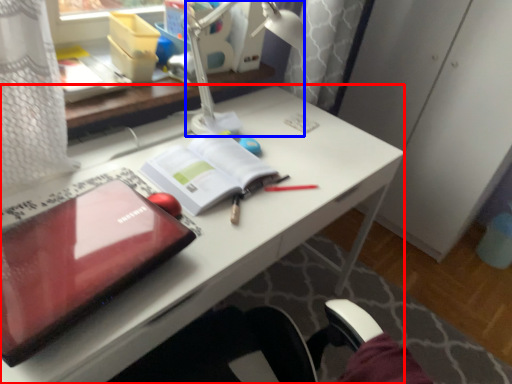
Question: Which of the following is the farthest to the observer, desk (highlighted by a red box) or lamp (highlighted by a blue box)?

Choices:
 (A) desk
 (B) lamp

Answer: (B)